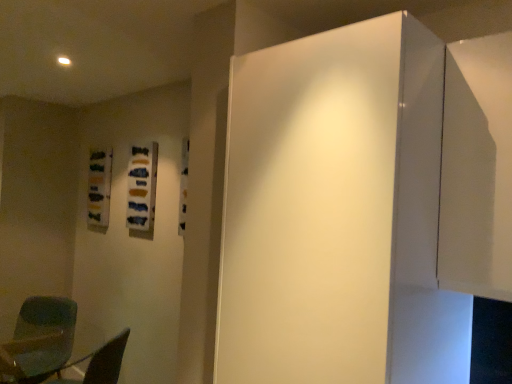
Question: Do you think white glossy door at center is within transparent plastic chair at lower left, or outside of it?

Choices:
 (A) inside
 (B) outside

Answer: (B)

Question: Looking at the image, does white glossy door at center seem bigger or smaller compared to transparent plastic chair at lower left?

Choices:
 (A) big
 (B) small

Answer: (A)

Question: Considering the real-world distances, which object is farthest from the white glossy door at center?

Choices:
 (A) transparent plastic chair at lower left
 (B) matte green chair at lower left

Answer: (B)

Question: Estimate the real-world distances between objects in this image. Which object is closer to the white glossy door at center?

Choices:
 (A) matte green chair at lower left
 (B) transparent plastic chair at lower left

Answer: (B)